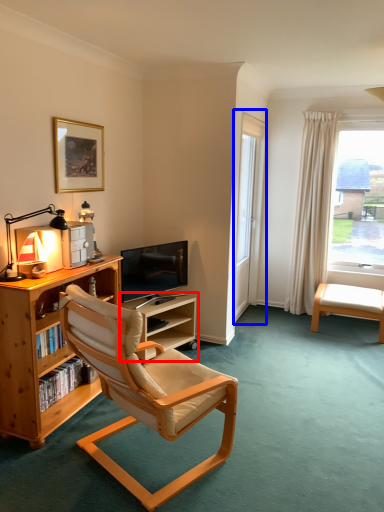
Question: Which of the following is the farthest to the observer, shelf (highlighted by a red box) or screen door (highlighted by a blue box)?

Choices:
 (A) shelf
 (B) screen door

Answer: (B)